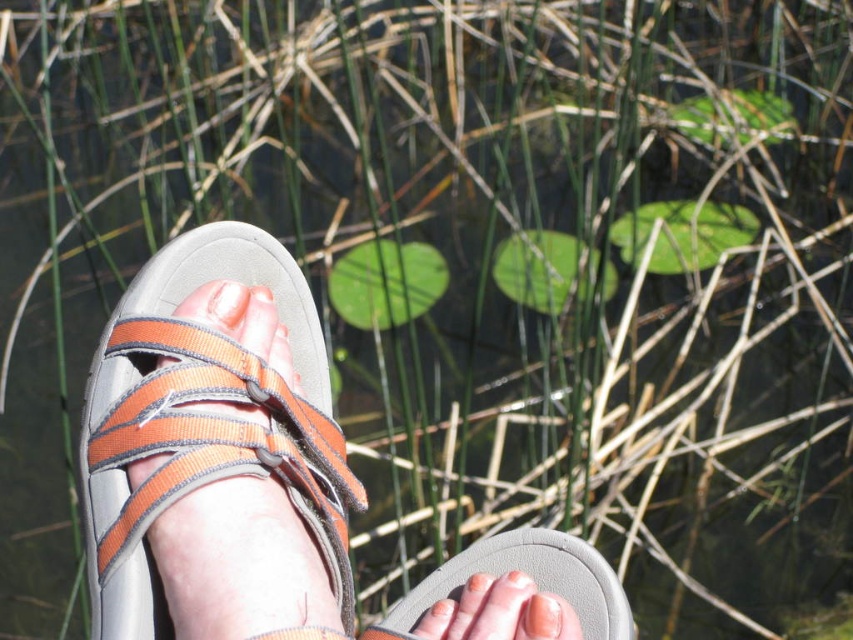
You are a photographer trying to capture the orange fabric sandal at left and the pink flesh at center in a single shot. Based on their positions, which object should you focus on first to ensure both are in the frame?

The orange fabric sandal at left is below the pink flesh at center, so you should focus on the pink flesh at center first to ensure both are in the frame.

You are a photographer trying to capture the orange fabric sandal at left and the pink flesh at center in the same frame. Based on their positions, which object should you focus on first to ensure both are in focus?

The orange fabric sandal at left has a greater height compared to the pink flesh at center, so you should focus on the orange fabric sandal at left first to ensure both are in focus.

You are standing at the point marked as point (83, 448). You want to place a 12 inch long stick between your feet. Is there enough space between your feet to place the stick horizontally?

The distance between your feet is 26.07 inches, which is more than enough to place a 12 inch long stick horizontally between them.